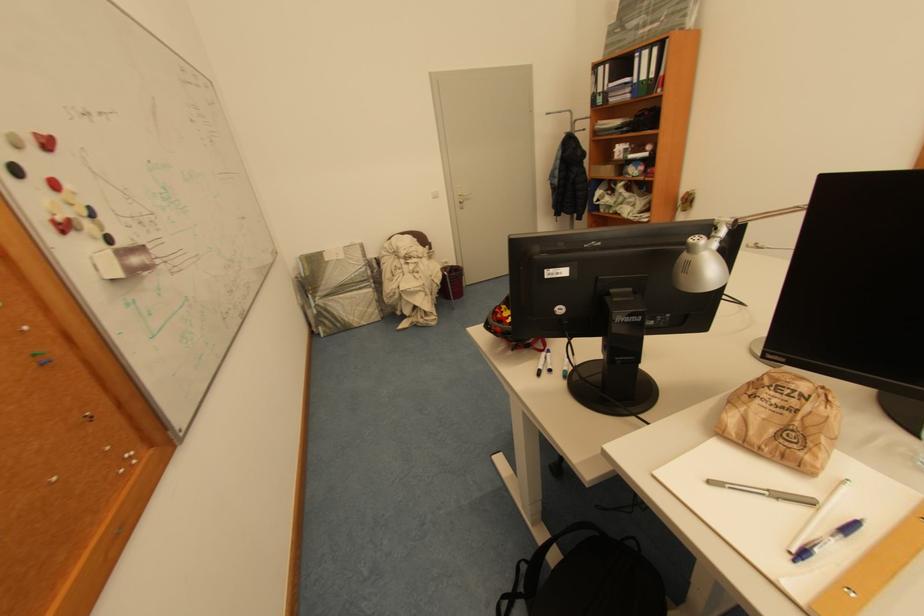
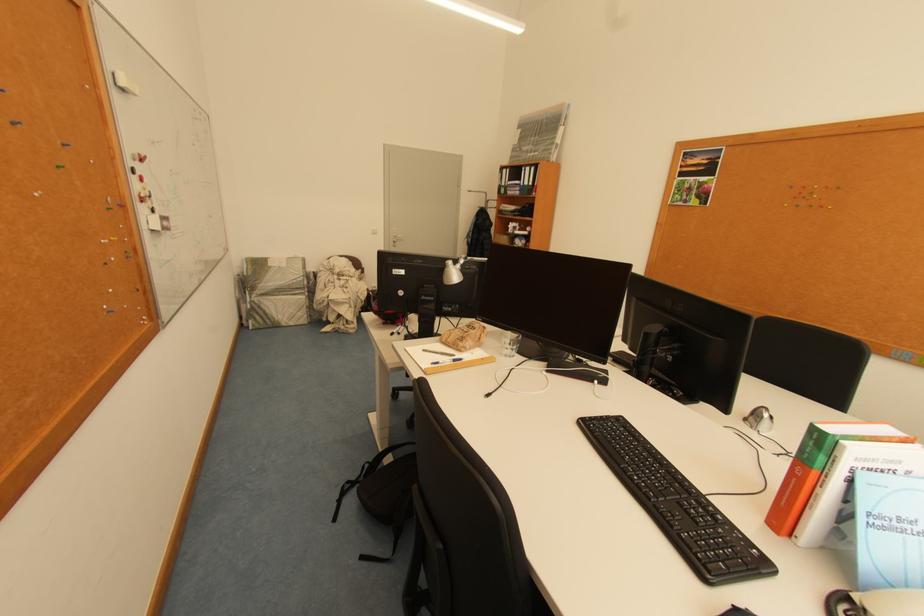
The images are taken continuously from a first-person perspective. In which direction are you moving?

The cameraman moved toward right, backward.